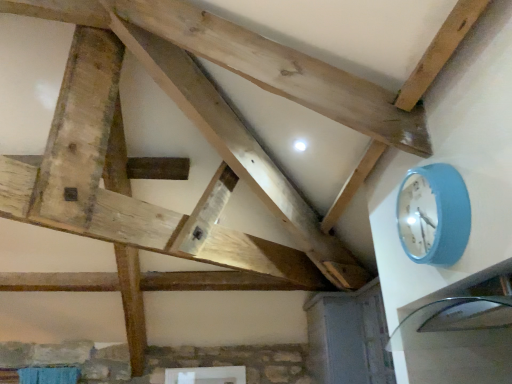
The height and width of the screenshot is (384, 512). Describe the element at coordinates (434, 215) in the screenshot. I see `blue plastic wall clock at upper right` at that location.

Find the location of a particular element. blue plastic wall clock at upper right is located at coordinates (434, 215).

You are a GUI agent. You are given a task and a screenshot of the screen. Output one action in this format:
    pyautogui.click(x=<x>, y=<y>)
    Task: Click on the blue plastic wall clock at upper right
    
    Given the screenshot: What is the action you would take?
    pos(434,215)